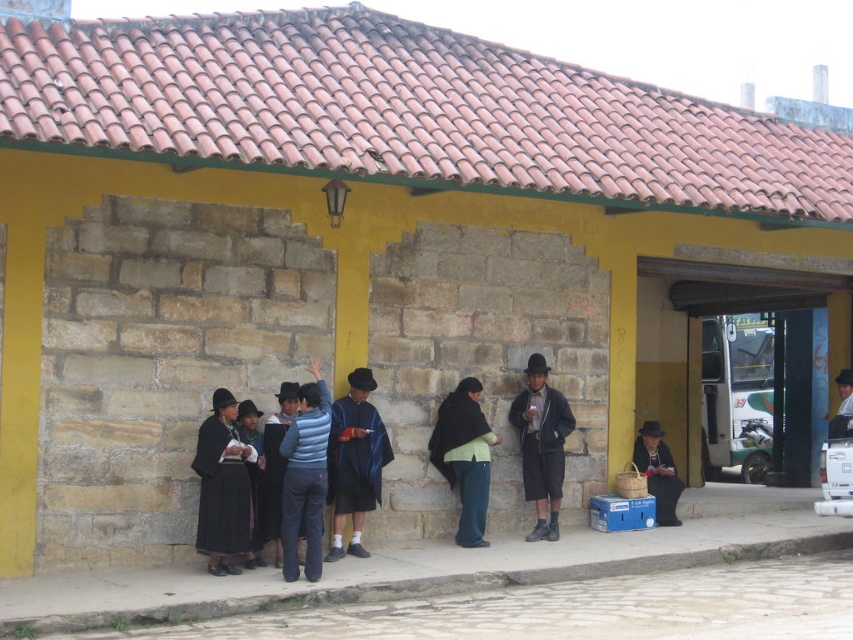
What do you see at coordinates (463, 456) in the screenshot? This screenshot has height=640, width=853. I see `dark green fabric at center` at bounding box center [463, 456].

Can you confirm if dark green fabric at center is bigger than black woolen dress at lower left?

Correct, dark green fabric at center is larger in size than black woolen dress at lower left.

The height and width of the screenshot is (640, 853). Find the location of `dark green fabric at center`. dark green fabric at center is located at coordinates (463, 456).

This screenshot has height=640, width=853. In order to click on dark green fabric at center in this screenshot , I will do pos(463,456).

Is black woolen dress at left above black woolen dress at lower left?

Yes, black woolen dress at left is above black woolen dress at lower left.

Who is taller, black woolen dress at left or black woolen dress at lower left?

With more height is black woolen dress at left.

Is point (212, 433) less distant than point (248, 544)?

No.

At what (x,y) coordinates should I click in order to perform the action: click on black woolen dress at left. Please return your answer as a coordinate pair (x, y). Image resolution: width=853 pixels, height=640 pixels. Looking at the image, I should click on [222, 486].

Does blue striped sweater at center appear on the left side of dark brown leather hat at center?

Correct, you'll find blue striped sweater at center to the left of dark brown leather hat at center.

The height and width of the screenshot is (640, 853). Identify the location of blue striped sweater at center. (305, 477).

Which is in front, point (299, 413) or point (556, 396)?

Point (299, 413)

I want to click on blue striped sweater at center, so click(305, 477).